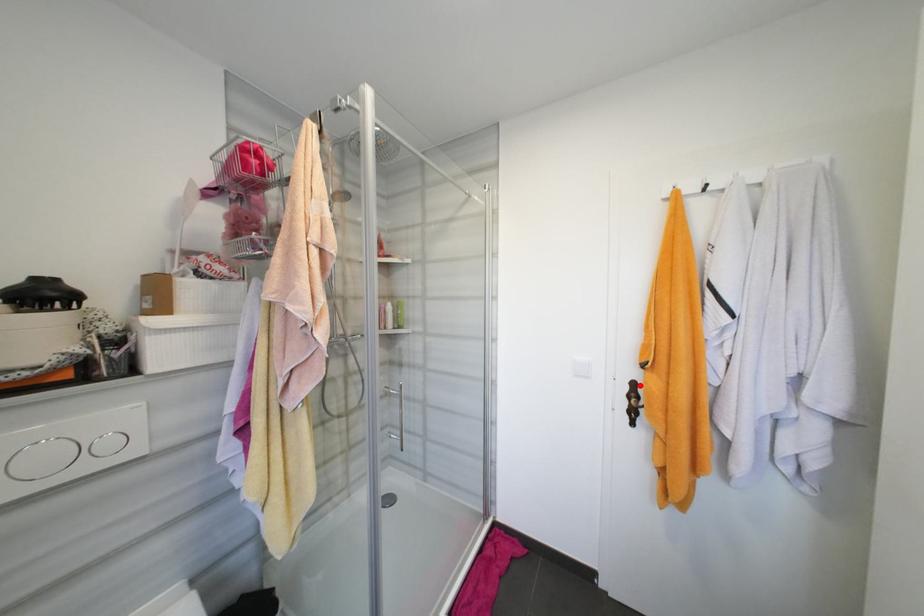
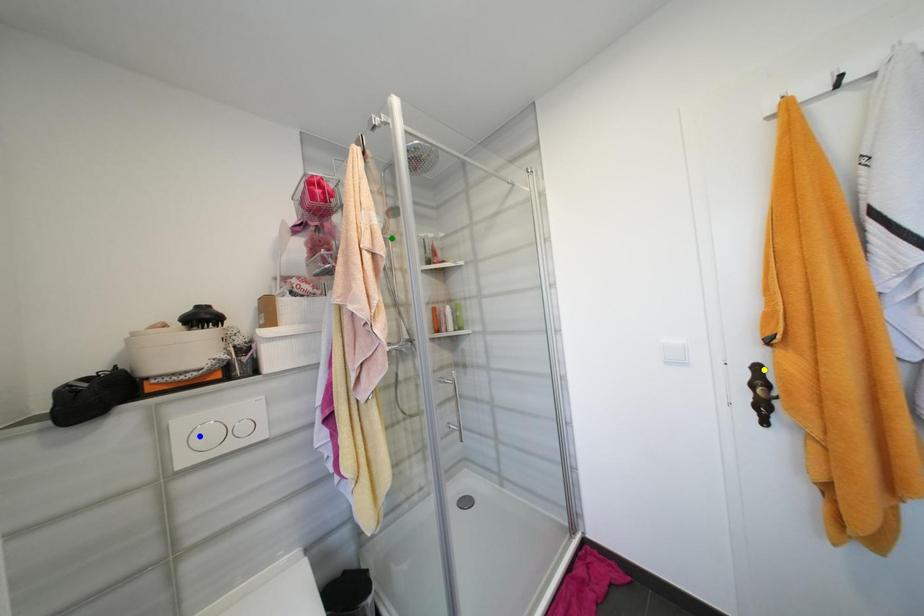
Question: I am providing you with two images of the same scene from different viewpoints. A red point is marked on the first image. You are given multiple points on the second image. Which point in image 2 represents the same 3d spot as the red point in image 1?

Choices:
 (A) blue point
 (B) green point
 (C) yellow point

Answer: (C)